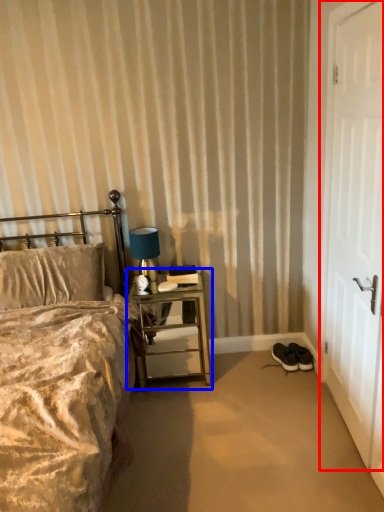
Question: Which point is closer to the camera, door (highlighted by a red box) or nightstand (highlighted by a blue box)?

Choices:
 (A) door
 (B) nightstand

Answer: (A)